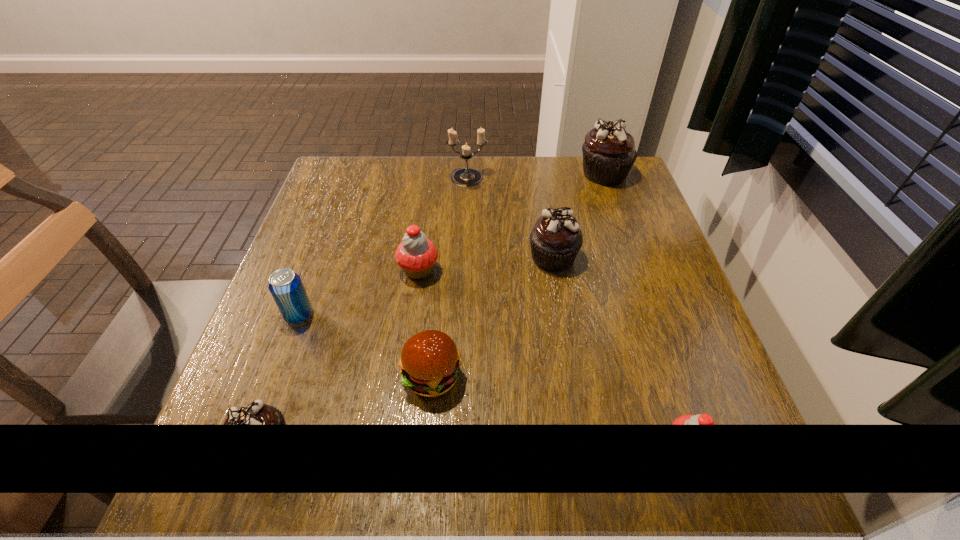
Where is `vacant space that satisfies the following two spatial constraints: 1. on the back side of the third nearest object; 2. on the left side of the biggest brown cupcake`? vacant space that satisfies the following two spatial constraints: 1. on the back side of the third nearest object; 2. on the left side of the biggest brown cupcake is located at coordinates (449, 174).

At what (x,y) coordinates should I click in order to perform the action: click on vacant space that satisfies the following two spatial constraints: 1. on the front side of the nearest brown cupcake; 2. on the right side of the fourth nearest object. Please return your answer as a coordinate pair (x, y). Image resolution: width=960 pixels, height=540 pixels. Looking at the image, I should click on [252, 443].

I want to click on vacant area that satisfies the following two spatial constraints: 1. on the front side of the brown hamburger; 2. on the right side of the nearer red cupcake, so click(426, 446).

This screenshot has height=540, width=960. What are the coordinates of `blank space that satisfies the following two spatial constraints: 1. on the back side of the leftmost cupcake; 2. on the left side of the tallest cupcake` in the screenshot? It's located at (358, 174).

What are the coordinates of `vacant space that satisfies the following two spatial constraints: 1. on the back side of the candle holder; 2. on the left side of the biggest brown cupcake` in the screenshot? It's located at (468, 174).